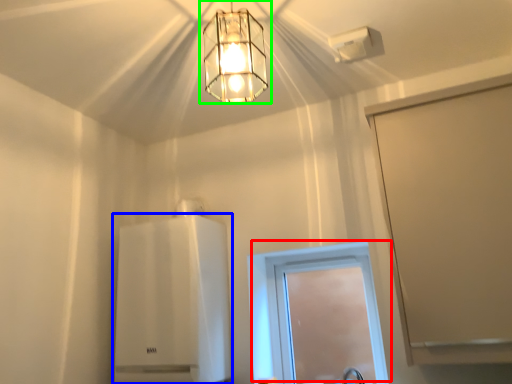
Question: Based on their relative distances, which object is nearer to window (highlighted by a red box)? Choose from appliance (highlighted by a blue box) and lamp (highlighted by a green box).

Choices:
 (A) appliance
 (B) lamp

Answer: (A)